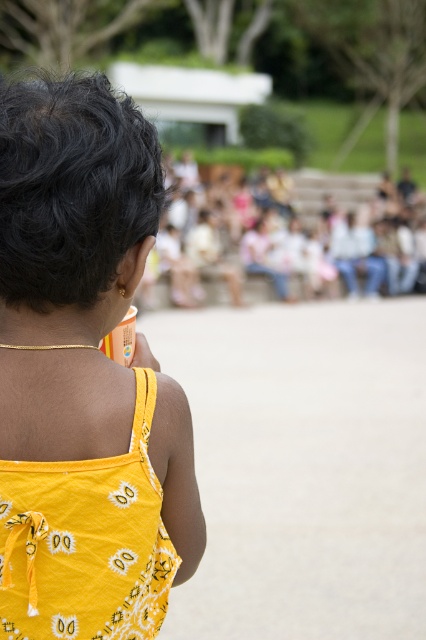
Does yellow printed tank top at center have a greater height compared to yellow printed fabric dress at center?

Yes, yellow printed tank top at center is taller than yellow printed fabric dress at center.

Does point (106, 531) lie in front of point (88, 573)?

Yes, point (106, 531) is in front of point (88, 573).

Who is more distant from viewer, (45, 516) or (25, 522)?

The point (45, 516) is behind.

Locate an element on the screen. yellow printed tank top at center is located at coordinates (x=83, y=374).